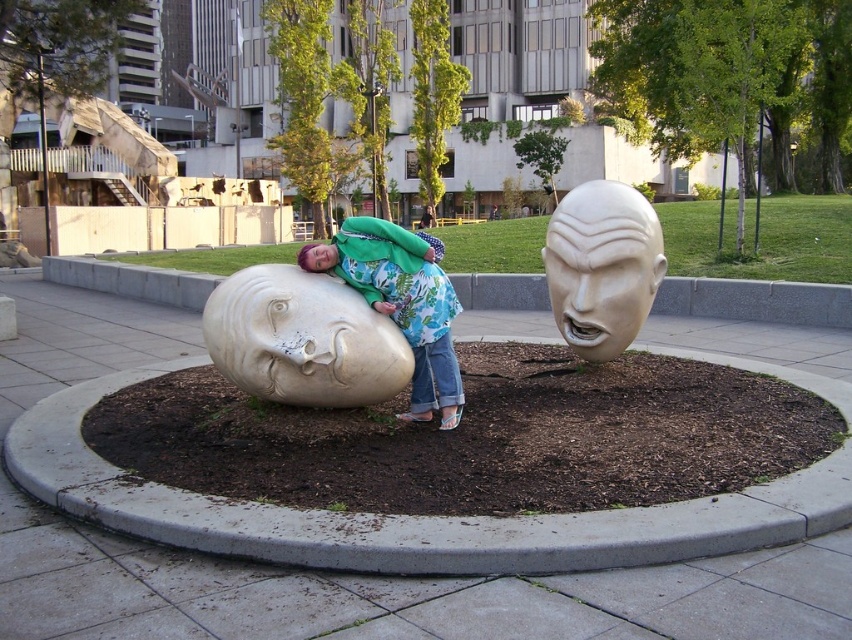
You are standing at point (567,326) and want to walk to the sculpture that is lying down. Given that the distance between the two sculptures is 19.67 feet, which direction should you go to reach the lying sculpture?

Since the distance between the two sculptures is 19.67 feet, you should go towards the sculpture that is lying down as you are already at the point between them.

You are a delivery person with a box that is 5 feet long. You need to move the box from the white marble head at upper right to the matte green jacket at center. Is the space between them wide enough to carry the box horizontally?

The distance between the white marble head at upper right and matte green jacket at center is 4.58 feet, which is shorter than the 5 feet length of the box. Therefore, the space is not wide enough to carry the box horizontally between them.

You are standing at the point marked by the coordinates point (303, 339) in the image. What object are you directly in front of?

You are directly in front of the matte white stone head at center, as the point (303, 339) marks its location.